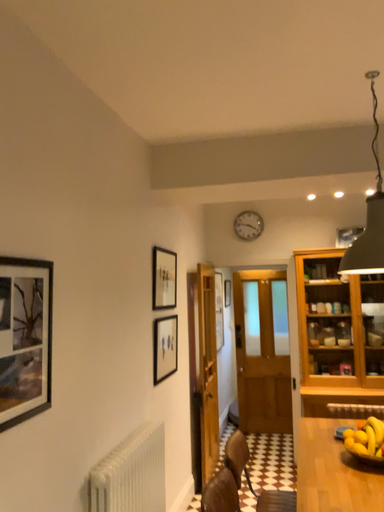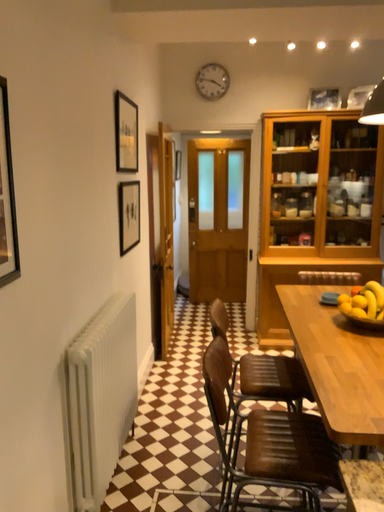
Question: How did the camera likely rotate when shooting the video?

Choices:
 (A) rotated upward
 (B) rotated downward

Answer: (B)